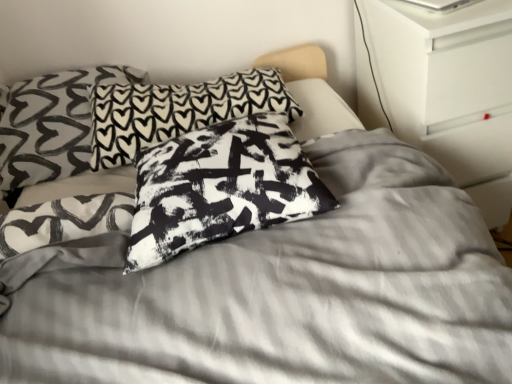
Question: Does black-and-white printed pillow at center, the 1th pillow positioned from the front, have a greater height compared to black printed pillow at center, which is counted as the 1th pillow, starting from the back?

Choices:
 (A) yes
 (B) no

Answer: (B)

Question: From a real-world perspective, does black-and-white printed pillow at center, the third pillow in the back-to-front sequence, stand above black printed pillow at center, which is counted as the 1th pillow, starting from the back?

Choices:
 (A) yes
 (B) no

Answer: (A)

Question: From a real-world perspective, is black-and-white printed pillow at center, the third pillow in the back-to-front sequence, beneath black printed pillow at center, placed as the 3th pillow when sorted from front to back?

Choices:
 (A) no
 (B) yes

Answer: (A)

Question: Is black-and-white printed pillow at center, the third pillow in the back-to-front sequence, beside black printed pillow at center, placed as the 3th pillow when sorted from front to back?

Choices:
 (A) yes
 (B) no

Answer: (B)

Question: Is black-and-white printed pillow at center, the third pillow in the back-to-front sequence, to the right of black printed pillow at center, which is counted as the 1th pillow, starting from the back, from the viewer's perspective?

Choices:
 (A) no
 (B) yes

Answer: (B)

Question: Does point (482, 215) appear closer or farther from the camera than point (33, 140)?

Choices:
 (A) farther
 (B) closer

Answer: (A)

Question: From their relative heights in the image, would you say white glossy dresser at upper right is taller or shorter than black and white printed pillow at center, positioned as the 2th pillow in back-to-front order?

Choices:
 (A) tall
 (B) short

Answer: (A)

Question: Which is correct: white glossy dresser at upper right is inside black and white printed pillow at center, acting as the second pillow starting from the front, or outside of it?

Choices:
 (A) outside
 (B) inside

Answer: (A)

Question: Considering the relative positions of white glossy dresser at upper right and black and white printed pillow at center, positioned as the 2th pillow in back-to-front order, in the image provided, is white glossy dresser at upper right to the left or to the right of black and white printed pillow at center, positioned as the 2th pillow in back-to-front order,?

Choices:
 (A) right
 (B) left

Answer: (A)

Question: Considering the positions of black printed pillow at center, placed as the 3th pillow when sorted from front to back, and white glossy dresser at upper right in the image, is black printed pillow at center, placed as the 3th pillow when sorted from front to back, bigger or smaller than white glossy dresser at upper right?

Choices:
 (A) big
 (B) small

Answer: (B)

Question: Would you say black printed pillow at center, placed as the 3th pillow when sorted from front to back, is inside or outside white glossy dresser at upper right?

Choices:
 (A) inside
 (B) outside

Answer: (B)

Question: Is point (128, 112) positioned closer to the camera than point (381, 49)?

Choices:
 (A) farther
 (B) closer

Answer: (B)

Question: In the image, is black printed pillow at center, placed as the 3th pillow when sorted from front to back, on the left side or the right side of white glossy dresser at upper right?

Choices:
 (A) right
 (B) left

Answer: (B)

Question: Is black-and-white printed pillow at center, the third pillow in the back-to-front sequence, wider or thinner than black and white printed pillow at center, acting as the second pillow starting from the front?

Choices:
 (A) thin
 (B) wide

Answer: (A)

Question: Looking at the image, does black-and-white printed pillow at center, the 1th pillow positioned from the front, seem bigger or smaller compared to black and white printed pillow at center, positioned as the 2th pillow in back-to-front order?

Choices:
 (A) small
 (B) big

Answer: (A)